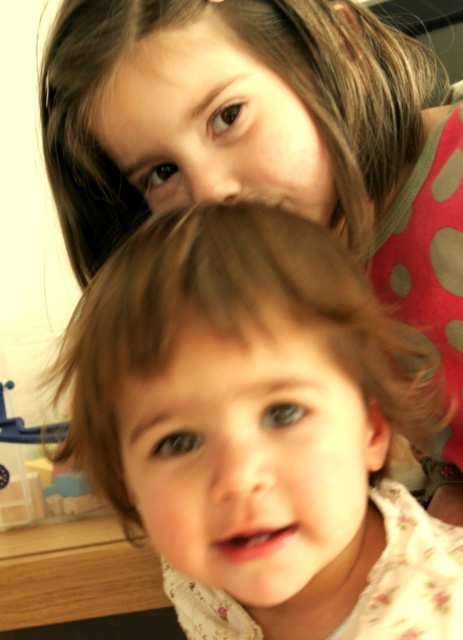
You are a photographer adjusting the focus on your camera. You have two points to focus on in the image. The first point is at coordinates point (160, 304), and the second is at point (58, 156). Which point should you focus on to ensure the child in the foreground is sharp?

You should focus on point (160, 304) because it is closer to the viewer than point (58, 156), ensuring the foreground child is in focus.

You are a photographer trying to capture a clear shot of both children. The fluffy brown hair at center belongs to the foreground child, and the brown smooth hair at upper center belongs to the background child. Which child has hair that is thicker?

The brown smooth hair at upper center is thicker than the fluffy brown hair at center.

You are a photographer trying to capture a portrait of the two children. You want to ensure that both the fluffy brown hair at center and the brown smooth hair at upper center are clearly visible. Based on their positions, which child should you adjust to be closer to the camera?

The fluffy brown hair at center is shorter than brown smooth hair at upper center. To ensure both are clearly visible, you should adjust the brown smooth hair at upper center to be closer to the camera since it is taller and might be partially out of focus if farther away.